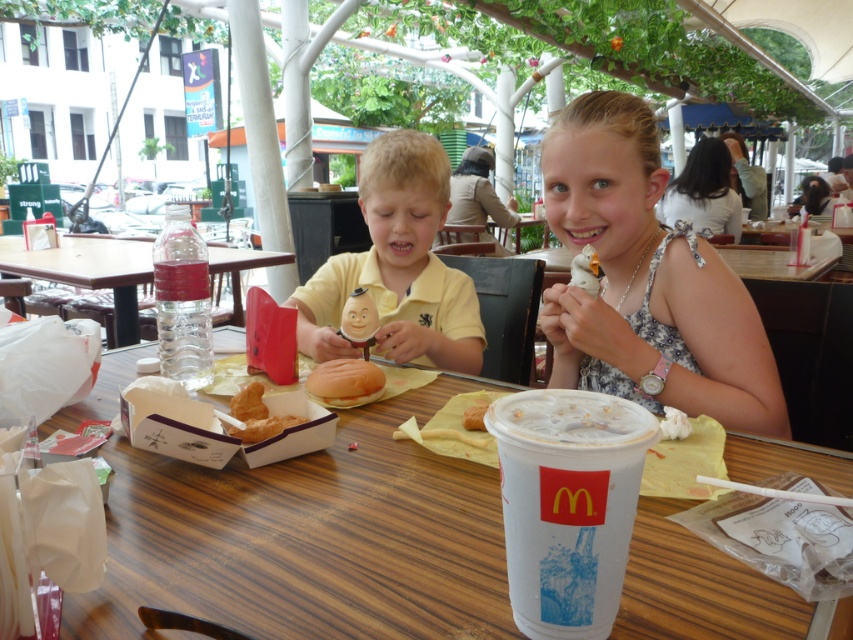
You are a parent trying to decide which item to take first from the table. The golden bread roll at center and the light brown hair at upper right are both on the table. Which one is smaller?

The golden bread roll at center is smaller than the light brown hair at upper right.

You are a customer at this McDonalds and you want to place your McDonalds cup on the table. The golden bread roll at center is in the way. Where should you place the cup so it doesn not block the bread roll?

The golden bread roll at center is located at point (344, 378). To avoid blocking it, place the cup somewhere else on the table not at that coordinate.

You are a photographer taking a picture of the yellow matte shirt at center and the smooth brown hair at upper right. Which object should you focus on first if you want to capture both in the same frame without moving the camera?

The yellow matte shirt at center is smaller than smooth brown hair at upper right, so you should focus on the smooth brown hair at upper right first since it is larger and will be easier to frame properly.